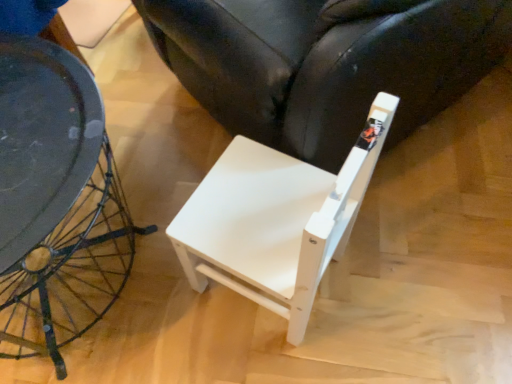
Question: Considering the positions of point (168, 236) and point (178, 76), is point (168, 236) closer or farther from the camera than point (178, 76)?

Choices:
 (A) farther
 (B) closer

Answer: (B)

Question: Do you think white matte chair at center, the 1th chair from the bottom, is within white matte chair at lower right, arranged as the 2th chair when ordered from the bottom, or outside of it?

Choices:
 (A) inside
 (B) outside

Answer: (B)

Question: From the image's perspective, relative to white matte chair at lower right, arranged as the 2th chair when ordered from the bottom, is white matte chair at center, the 1th chair from the bottom, above or below?

Choices:
 (A) above
 (B) below

Answer: (B)

Question: From the image's perspective, is white matte chair at lower right, arranged as the 2th chair when ordered from the bottom, above or below white matte chair at center, the 1th chair from the bottom?

Choices:
 (A) below
 (B) above

Answer: (B)

Question: Is white matte chair at lower right, the first chair when ordered from top to bottom, wider or thinner than white matte chair at center, the 1th chair from the bottom?

Choices:
 (A) wide
 (B) thin

Answer: (A)

Question: Is white matte chair at lower right, arranged as the 2th chair when ordered from the bottom, taller or shorter than white matte chair at center, the second chair viewed from the top?

Choices:
 (A) short
 (B) tall

Answer: (B)

Question: Considering the positions of white matte chair at lower right, arranged as the 2th chair when ordered from the bottom, and white matte chair at center, the 1th chair from the bottom, in the image, is white matte chair at lower right, arranged as the 2th chair when ordered from the bottom, bigger or smaller than white matte chair at center, the 1th chair from the bottom,?

Choices:
 (A) big
 (B) small

Answer: (A)